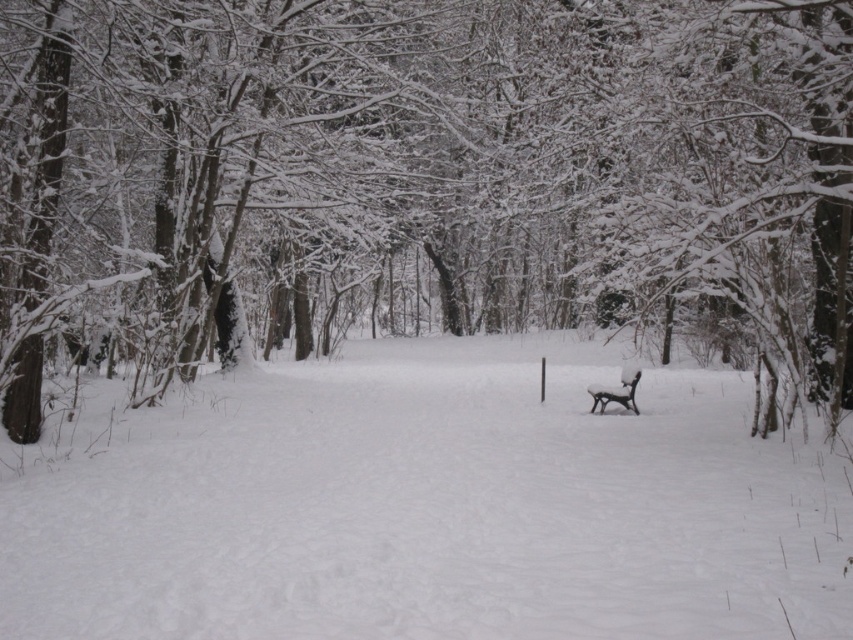
Between white fluffy snow at center and snow-covered wooden bench at center, which one appears on the right side from the viewer's perspective?

snow-covered wooden bench at center is more to the right.

Can you confirm if white fluffy snow at center is positioned to the left of snow-covered wooden bench at center?

Yes, white fluffy snow at center is to the left of snow-covered wooden bench at center.

Between point (96, 580) and point (625, 394), which one is positioned in front?

Point (96, 580)

The width and height of the screenshot is (853, 640). I want to click on white fluffy snow at center, so click(x=425, y=504).

Is point (482, 65) positioned behind point (408, 451)?

That is True.

Based on the photo, is snow-covered tree at center bigger than white fluffy snow at center?

Indeed, snow-covered tree at center has a larger size compared to white fluffy snow at center.

Find the location of a particular element. snow-covered tree at center is located at coordinates (424, 172).

Is the position of snow-covered tree at center less distant than that of snow-covered wooden bench at center?

Yes.

Find the location of a particular element. The width and height of the screenshot is (853, 640). snow-covered tree at center is located at coordinates (424, 172).